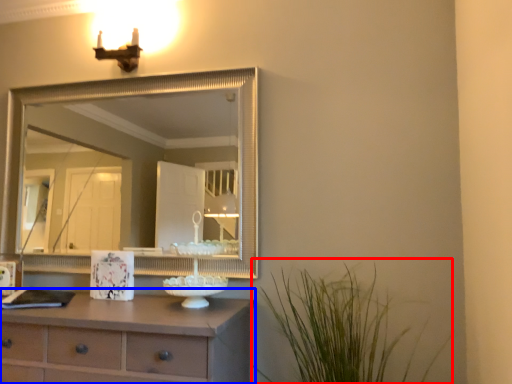
Question: Among these objects, which one is nearest to the camera, plant (highlighted by a red box) or chest of drawers (highlighted by a blue box)?

Choices:
 (A) plant
 (B) chest of drawers

Answer: (A)